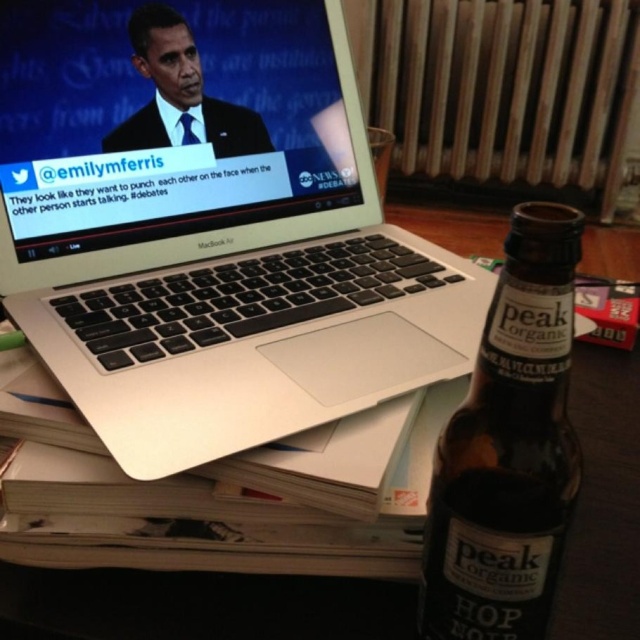
You are organizing a tech conference and need to set up two laptops for a presentation. The silver metallic laptop at upper left and the matte black laptop at upper left are both on the same table. Which laptop will you see first when looking at the table from above?

The silver metallic laptop at upper left will be seen first because it is positioned in front of the matte black laptop at upper left, making it more visible from above.